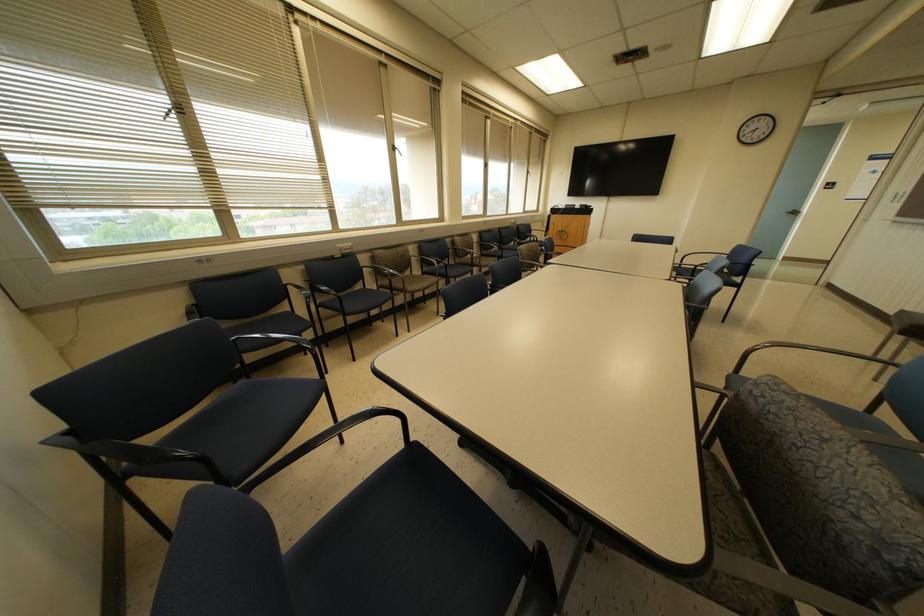
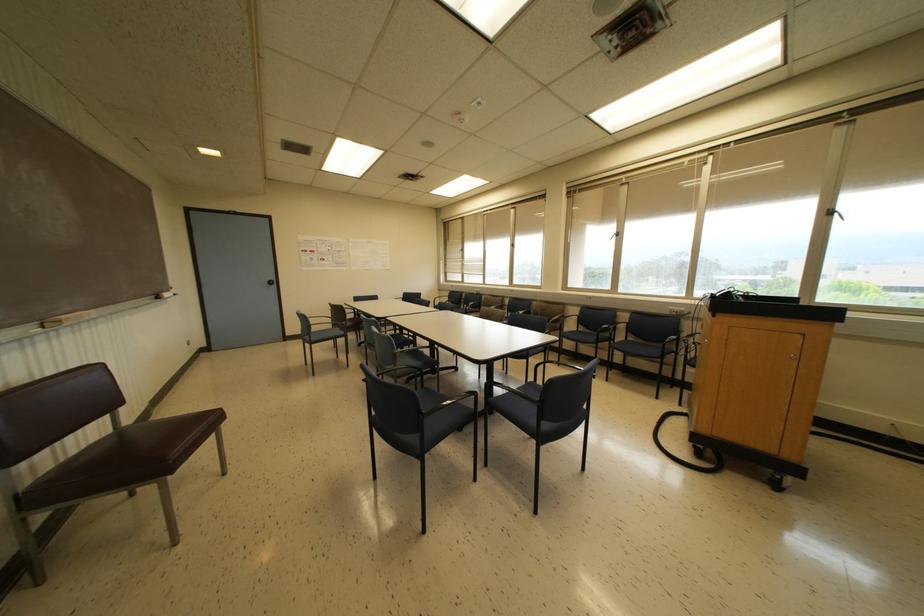
Where in the second image is the point corresponding to (x=527, y=172) from the first image?

(827, 213)